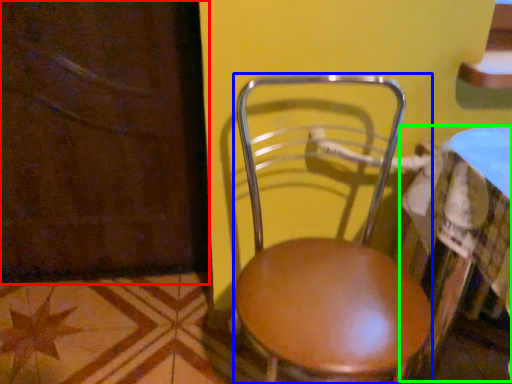
Question: Based on their relative distances, which object is nearer to screen door (highlighted by a red box)? Choose from chair (highlighted by a blue box) and table (highlighted by a green box).

Choices:
 (A) chair
 (B) table

Answer: (A)